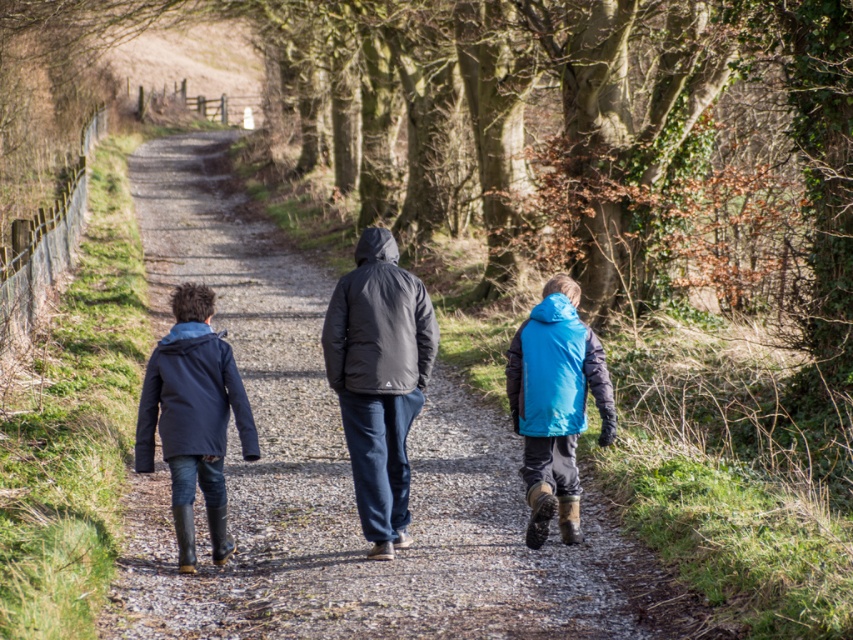
You are a photographer trying to capture a group of people walking on a gravel path. You notice two jackets in the scene, a matte black jacket at center and a dark gray puffer jacket at center. From the photographer standing behind them, which jacket is positioned more to the left?

The matte black jacket at center is positioned more to the left compared to the dark gray puffer jacket at center, as it is located to the left of it.

You are standing on the gravel path in the image and want to walk towards the point with coordinates point (233, 221) and point (376, 333). Which point should you walk towards first to reach the one closer to you?

You should walk towards point (233, 221) first because it is closer to you than point (376, 333), which is further away.

You are a photographer trying to capture a photo of the matte black jacket at center and the matte blue jacket at left. Since you want to ensure both subjects are in focus, you need to know their heights. Which jacket is taller?

The matte black jacket at center is taller than the matte blue jacket at left.